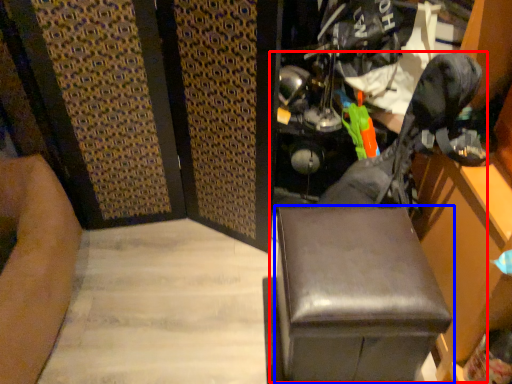
Question: Which point is closer to the camera, swivel chair (highlighted by a red box) or furniture (highlighted by a blue box)?

Choices:
 (A) swivel chair
 (B) furniture

Answer: (A)